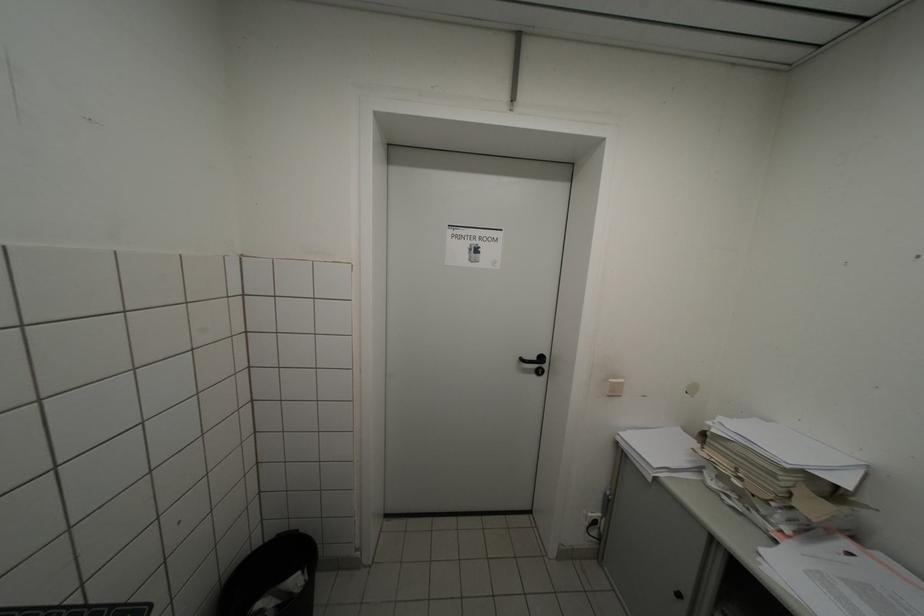
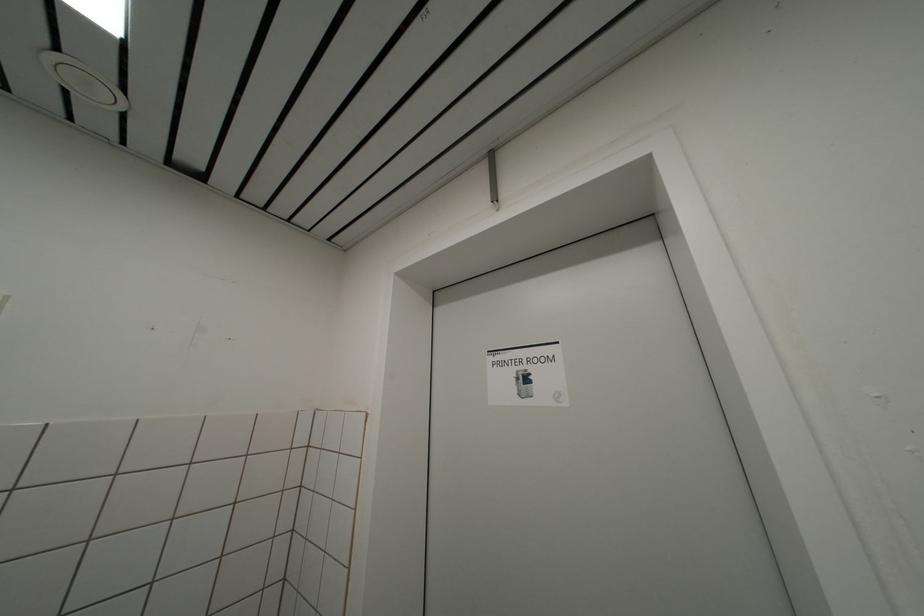
The first image is from the beginning of the video and the second image is from the end. How did the camera likely rotate when shooting the video?

The camera rotated toward left-up.